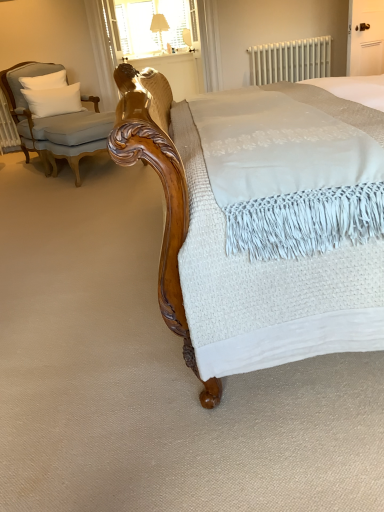
Question: Is white metallic radiator at upper center beside matte cream fabric table lamp at upper center?

Choices:
 (A) no
 (B) yes

Answer: (A)

Question: Is white metallic radiator at upper center at the left side of matte cream fabric table lamp at upper center?

Choices:
 (A) yes
 (B) no

Answer: (B)

Question: From a real-world perspective, is white metallic radiator at upper center over matte cream fabric table lamp at upper center?

Choices:
 (A) no
 (B) yes

Answer: (A)

Question: Is white metallic radiator at upper center not within matte cream fabric table lamp at upper center?

Choices:
 (A) no
 (B) yes

Answer: (B)

Question: Does white metallic radiator at upper center appear on the right side of matte cream fabric table lamp at upper center?

Choices:
 (A) yes
 (B) no

Answer: (A)

Question: From their relative heights in the image, would you say wooden balustrade at upper center is taller or shorter than white soft cushion at upper left?

Choices:
 (A) tall
 (B) short

Answer: (A)

Question: Looking at the image, does wooden balustrade at upper center seem bigger or smaller compared to white soft cushion at upper left?

Choices:
 (A) big
 (B) small

Answer: (A)

Question: From the image's perspective, is wooden balustrade at upper center above or below white soft cushion at upper left?

Choices:
 (A) above
 (B) below

Answer: (A)

Question: Considering the positions of point click(160, 61) and point click(56, 103), is point click(160, 61) closer or farther from the camera than point click(56, 103)?

Choices:
 (A) farther
 (B) closer

Answer: (A)

Question: Is point (46, 92) closer or farther from the camera than point (69, 122)?

Choices:
 (A) farther
 (B) closer

Answer: (A)

Question: Do you think white soft cushion at upper left is within light gray fabric chair at left, or outside of it?

Choices:
 (A) inside
 (B) outside

Answer: (A)

Question: Is white soft cushion at upper left wider or thinner than light gray fabric chair at left?

Choices:
 (A) thin
 (B) wide

Answer: (A)

Question: In the image, is white soft cushion at upper left positioned in front of or behind light gray fabric chair at left?

Choices:
 (A) behind
 (B) front

Answer: (A)

Question: Do you think white soft cushion at upper left is within white fabric at upper center, or outside of it?

Choices:
 (A) inside
 (B) outside

Answer: (B)

Question: Is point (51, 106) closer or farther from the camera than point (150, 10)?

Choices:
 (A) closer
 (B) farther

Answer: (A)